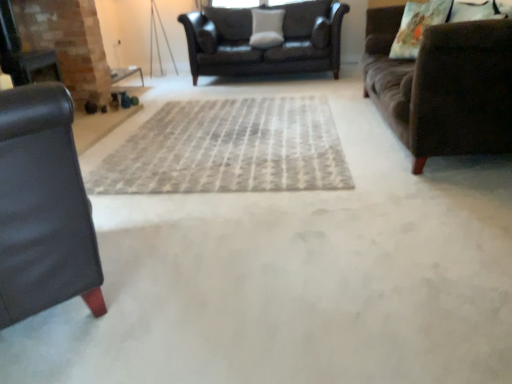
Question: Does white fabric pillow at center, marked as the 1th pillow in a left-to-right arrangement, come in front of brown fabric couch at right, the 2th studio couch in the back-to-front sequence?

Choices:
 (A) no
 (B) yes

Answer: (A)

Question: Could you tell me if white fabric pillow at center, the second pillow from the right, is facing brown fabric couch at right, which is the 2th studio couch in front-to-back order?

Choices:
 (A) yes
 (B) no

Answer: (B)

Question: Considering the relative sizes of white fabric pillow at center, positioned as the second pillow in bottom-to-top order, and brown fabric couch at right, the 2th studio couch in the back-to-front sequence, in the image provided, is white fabric pillow at center, positioned as the second pillow in bottom-to-top order, shorter than brown fabric couch at right, the 2th studio couch in the back-to-front sequence,?

Choices:
 (A) yes
 (B) no

Answer: (A)

Question: From a real-world perspective, is white fabric pillow at center, positioned as the second pillow in bottom-to-top order, beneath brown fabric couch at right, which is the 2th studio couch in front-to-back order?

Choices:
 (A) no
 (B) yes

Answer: (A)

Question: Is white fabric pillow at center, which ranks as the 1th pillow in top-to-bottom order, surrounding brown fabric couch at right, the 2th studio couch in the back-to-front sequence?

Choices:
 (A) yes
 (B) no

Answer: (B)

Question: Considering the positions of gray woven rug at center and dark brown leather couch at center, which is counted as the third studio couch, starting from the front, in the image, is gray woven rug at center bigger or smaller than dark brown leather couch at center, which is counted as the third studio couch, starting from the front,?

Choices:
 (A) big
 (B) small

Answer: (B)

Question: Relative to dark brown leather couch at center, which is counted as the third studio couch, starting from the front, is gray woven rug at center in front or behind?

Choices:
 (A) front
 (B) behind

Answer: (A)

Question: Is gray woven rug at center spatially inside dark brown leather couch at center, the 1th studio couch from the back, or outside of it?

Choices:
 (A) inside
 (B) outside

Answer: (B)

Question: From a real-world perspective, is gray woven rug at center positioned above or below dark brown leather couch at center, which is counted as the third studio couch, starting from the front?

Choices:
 (A) above
 (B) below

Answer: (B)

Question: Is printed fabric pillow at upper right, positioned as the 2th pillow in left-to-right order, taller or shorter than gray woven rug at center?

Choices:
 (A) short
 (B) tall

Answer: (B)

Question: Considering the positions of point (414, 44) and point (205, 163), is point (414, 44) closer or farther from the camera than point (205, 163)?

Choices:
 (A) closer
 (B) farther

Answer: (B)

Question: From the image's perspective, is printed fabric pillow at upper right, marked as the 2th pillow in a back-to-front arrangement, above or below gray woven rug at center?

Choices:
 (A) below
 (B) above

Answer: (B)

Question: Based on their positions, is printed fabric pillow at upper right, which is the first pillow from bottom to top, located to the left or right of gray woven rug at center?

Choices:
 (A) left
 (B) right

Answer: (B)

Question: Looking at the image, does black leather couch at left, the 3th studio couch when ordered from back to front, seem bigger or smaller compared to black leather fireplace at left?

Choices:
 (A) small
 (B) big

Answer: (B)

Question: Is black leather couch at left, which ranks as the first studio couch in front-to-back order, spatially inside black leather fireplace at left, or outside of it?

Choices:
 (A) outside
 (B) inside

Answer: (A)